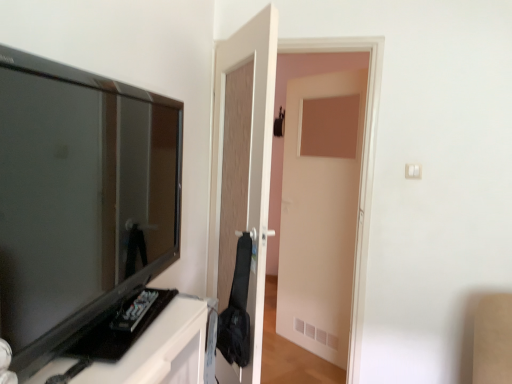
Question: Is matte black tv at left to the left or to the right of wooden door at center in the image?

Choices:
 (A) left
 (B) right

Answer: (A)

Question: In the image, is matte black tv at left positioned in front of or behind wooden door at center?

Choices:
 (A) behind
 (B) front

Answer: (B)

Question: Considering the positions of matte black tv at left and wooden door at center in the image, is matte black tv at left wider or thinner than wooden door at center?

Choices:
 (A) thin
 (B) wide

Answer: (A)

Question: Is wooden door at center taller or shorter than matte black tv at left?

Choices:
 (A) tall
 (B) short

Answer: (A)

Question: From a real-world perspective, is wooden door at center positioned above or below matte black tv at left?

Choices:
 (A) below
 (B) above

Answer: (A)

Question: Looking at the image, does wooden door at center seem bigger or smaller compared to matte black tv at left?

Choices:
 (A) small
 (B) big

Answer: (B)

Question: Does point pyautogui.click(x=220, y=100) appear closer or farther from the camera than point pyautogui.click(x=112, y=104)?

Choices:
 (A) closer
 (B) farther

Answer: (B)